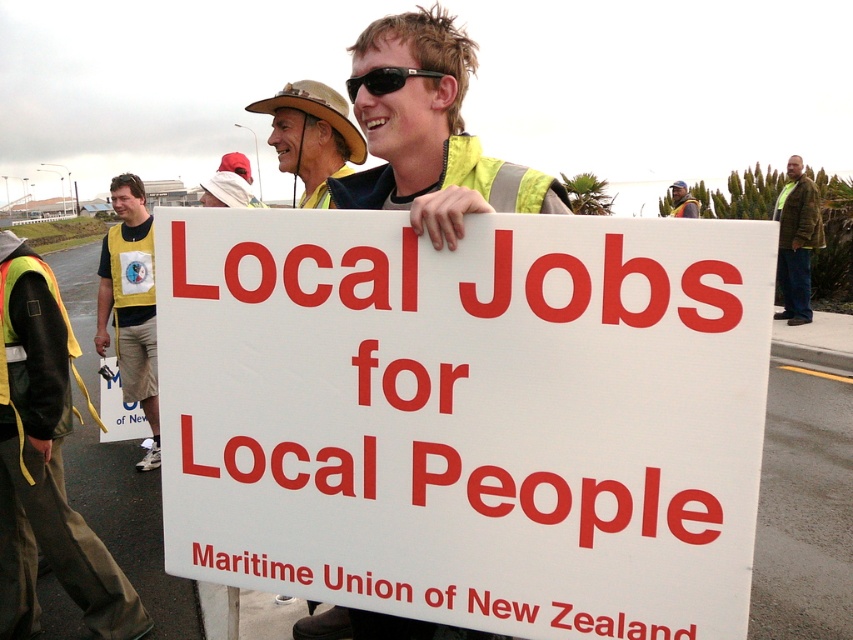
In the scene of a public demonstration with the central figure holding a large white sign, where exactly is the camouflage jacket at right located in terms of its 2D coordinates?

The camouflage jacket at right is located at the 2D coordinates of point (x=796, y=241).

You are a photographer standing at the camera position. You want to take a closeup photo of the Maritime Union of New Zealand sign held by the central figure. The sign is located at point (786, 282). Can you reach the sign with your camera? The camera has a maximum zoom range of 30 feet.

The point (786, 282) is 31.26 feet from the camera. Since the camera can only zoom up to 30 feet, you cannot reach the sign with your current camera settings.

Based on the scene description, can you determine if the camouflage jacket at right has a greater width than the matte yellow safety vest at center?

The camouflage jacket at right might be wider than matte yellow safety vest at center according to the description.